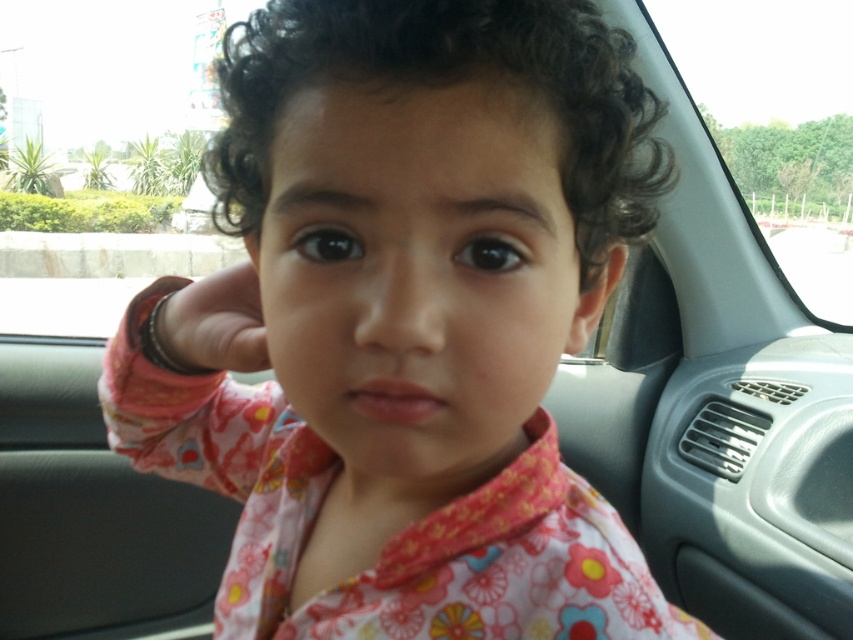
You are a photographer trying to capture the floral fabric shirt at center and the transparent glass car window at upper right in the same frame. Based on their positions, which object is closer to the camera?

The floral fabric shirt at center is positioned under the transparent glass car window at upper right, meaning the shirt is closer to the camera than the window.

You are designing a car seat cover that needs to avoid covering the floral fabric shirt at center. Based on the coordinates provided, where should you place the seat cover to ensure it doesn

The floral fabric shirt at center is located at coordinates point (410,323). To avoid covering it, the seat cover should be placed away from this central area.

You are a driver who wants to check the weather outside by looking through the transparent glass car window at upper right. Where exactly should you look on the car window to see the weather outside?

The transparent glass car window at upper right is located at point (776, 120), so you should look at that specific coordinate on the car window to see the weather outside.